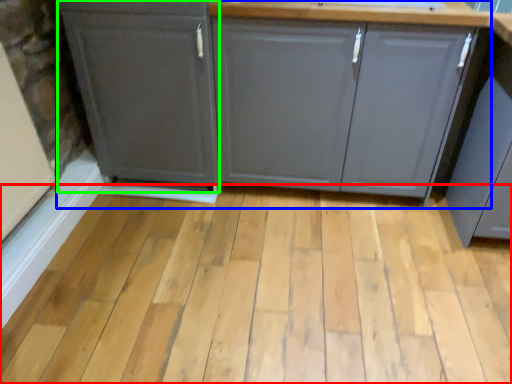
Question: Which object is positioned closest to plank (highlighted by a red box)? Select from cabinetry (highlighted by a blue box) and cabinetry (highlighted by a green box).

Choices:
 (A) cabinetry
 (B) cabinetry

Answer: (A)